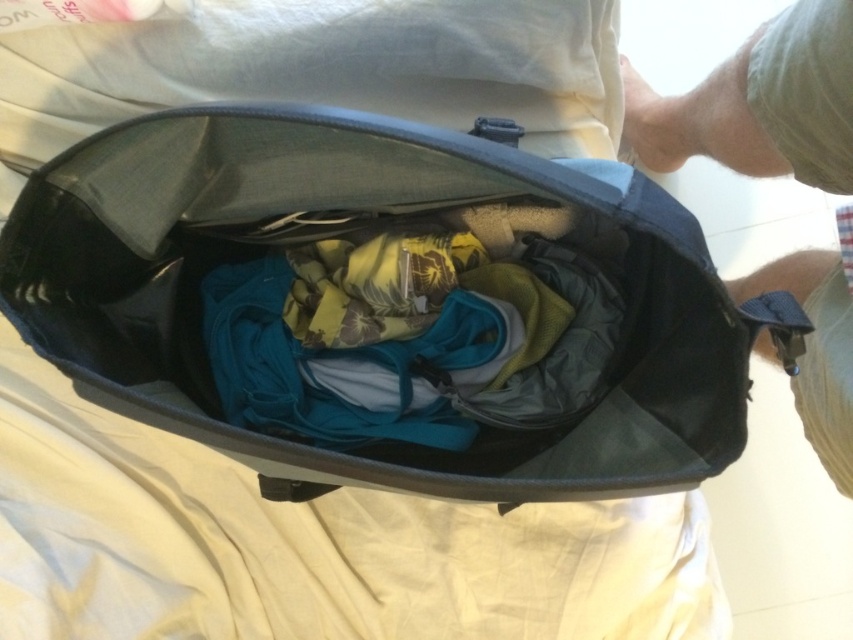
Between matte black bag at center and skinny jeans at right, which one appears on the left side from the viewer's perspective?

From the viewer's perspective, matte black bag at center appears more on the left side.

Where is `matte black bag at center`? Image resolution: width=853 pixels, height=640 pixels. matte black bag at center is located at coordinates (343, 236).

Where is `matte black bag at center`? This screenshot has width=853, height=640. matte black bag at center is located at coordinates (343, 236).

Image resolution: width=853 pixels, height=640 pixels. What do you see at coordinates (343, 236) in the screenshot?
I see `matte black bag at center` at bounding box center [343, 236].

Is the position of matte black bag at center more distant than that of teal fabric clothing at center?

No, matte black bag at center is in front of teal fabric clothing at center.

Which is behind, point (251, 160) or point (541, 282)?

Point (541, 282)

Image resolution: width=853 pixels, height=640 pixels. What are the coordinates of `matte black bag at center` in the screenshot? It's located at (343, 236).

Can you confirm if skinny jeans at right is positioned above khaki cotton shorts at lower right?

Yes.

Is skinny jeans at right further to the viewer compared to khaki cotton shorts at lower right?

No, it is not.

Image resolution: width=853 pixels, height=640 pixels. What are the coordinates of `skinny jeans at right` in the screenshot? It's located at (759, 104).